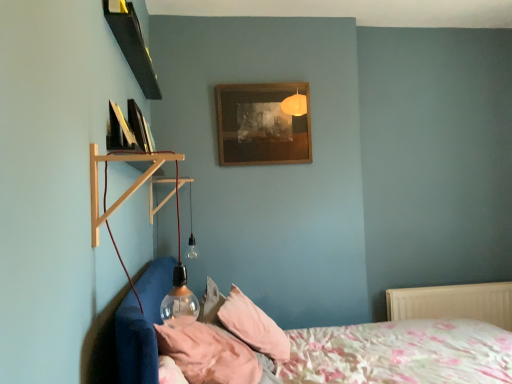
Question: Does floral cotton bed at lower left lie behind pink fabric pillow at lower center, which appears as the 1th pillow when viewed from the front?

Choices:
 (A) no
 (B) yes

Answer: (A)

Question: Could you tell me if floral cotton bed at lower left is facing pink fabric pillow at lower center, which is the second pillow in back-to-front order?

Choices:
 (A) yes
 (B) no

Answer: (B)

Question: Does floral cotton bed at lower left have a greater width compared to pink fabric pillow at lower center, which appears as the 1th pillow when viewed from the front?

Choices:
 (A) yes
 (B) no

Answer: (A)

Question: Can you confirm if floral cotton bed at lower left is thinner than pink fabric pillow at lower center, which is the second pillow in back-to-front order?

Choices:
 (A) no
 (B) yes

Answer: (A)

Question: From the image's perspective, does floral cotton bed at lower left appear lower than pink fabric pillow at lower center, which is the second pillow in back-to-front order?

Choices:
 (A) yes
 (B) no

Answer: (A)

Question: Is wooden frame at upper center, arranged as the first picture frame when viewed from the right, taller or shorter than black glossy picture frame at upper left, which appears as the first picture frame when viewed from the front?

Choices:
 (A) short
 (B) tall

Answer: (B)

Question: Would you say wooden frame at upper center, marked as the 1th picture frame in a back-to-front arrangement, is inside or outside black glossy picture frame at upper left, positioned as the 2th picture frame in back-to-front order?

Choices:
 (A) outside
 (B) inside

Answer: (A)

Question: Considering the positions of wooden frame at upper center, arranged as the first picture frame when viewed from the right, and black glossy picture frame at upper left, acting as the first picture frame starting from the left, in the image, is wooden frame at upper center, arranged as the first picture frame when viewed from the right, wider or thinner than black glossy picture frame at upper left, acting as the first picture frame starting from the left,?

Choices:
 (A) wide
 (B) thin

Answer: (B)

Question: From a real-world perspective, relative to black glossy picture frame at upper left, positioned as the 2th picture frame in back-to-front order, is wooden frame at upper center, which is the second picture frame in front-to-back order, vertically above or below?

Choices:
 (A) below
 (B) above

Answer: (B)

Question: Looking at the image, does pink fabric pillow at lower center, which is the second pillow in back-to-front order, seem bigger or smaller compared to pink fabric pillow at lower center, the 1th pillow positioned from the back?

Choices:
 (A) small
 (B) big

Answer: (A)

Question: Would you say pink fabric pillow at lower center, which is the second pillow in back-to-front order, is to the left or to the right of pink fabric pillow at lower center, which is the second pillow in front-to-back order, in the picture?

Choices:
 (A) left
 (B) right

Answer: (A)

Question: Is point (159, 331) positioned closer to the camera than point (258, 324)?

Choices:
 (A) closer
 (B) farther

Answer: (A)

Question: Considering the positions of pink fabric pillow at lower center, which is the second pillow in back-to-front order, and pink fabric pillow at lower center, which is the second pillow in front-to-back order, in the image, is pink fabric pillow at lower center, which is the second pillow in back-to-front order, taller or shorter than pink fabric pillow at lower center, which is the second pillow in front-to-back order,?

Choices:
 (A) tall
 (B) short

Answer: (B)

Question: Is pink fabric pillow at lower center, which appears as the 1th pillow when viewed from the front, spatially inside wooden shelf at left, or outside of it?

Choices:
 (A) inside
 (B) outside

Answer: (B)

Question: Considering the positions of pink fabric pillow at lower center, which appears as the 1th pillow when viewed from the front, and wooden shelf at left in the image, is pink fabric pillow at lower center, which appears as the 1th pillow when viewed from the front, bigger or smaller than wooden shelf at left?

Choices:
 (A) big
 (B) small

Answer: (A)